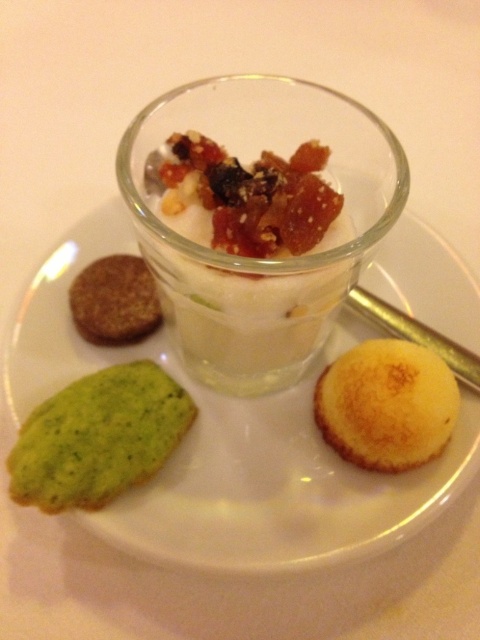
Can you confirm if green textured cookie at lower left is bigger than brown crumbly cookie at left?

Correct, green textured cookie at lower left is larger in size than brown crumbly cookie at left.

Who is lower down, green textured cookie at lower left or brown crumbly cookie at left?

green textured cookie at lower left is lower down.

Between point (45, 480) and point (119, 260), which one is positioned in front?

Point (45, 480)

Locate an element on the screen. This screenshot has height=640, width=480. green textured cookie at lower left is located at coordinates (98, 436).

Is green textured cookie at lower left to the right of golden brown sponge cake at lower right from the viewer's perspective?

Incorrect, green textured cookie at lower left is not on the right side of golden brown sponge cake at lower right.

Between green textured cookie at lower left and golden brown sponge cake at lower right, which one appears on the left side from the viewer's perspective?

From the viewer's perspective, green textured cookie at lower left appears more on the left side.

You are a GUI agent. You are given a task and a screenshot of the screen. Output one action in this format:
    pyautogui.click(x=<x>, y=<y>)
    Task: Click on the green textured cookie at lower left
    
    Given the screenshot: What is the action you would take?
    pyautogui.click(x=98, y=436)

The width and height of the screenshot is (480, 640). In order to click on green textured cookie at lower left in this screenshot , I will do `click(98, 436)`.

Between point (189, 506) and point (92, 310), which one is positioned behind?

Point (92, 310)

Does point (93, 513) lie behind point (97, 344)?

No.

This screenshot has height=640, width=480. Describe the element at coordinates (229, 445) in the screenshot. I see `translucent glass dessert at center` at that location.

Identify the location of translucent glass dessert at center. (229, 445).